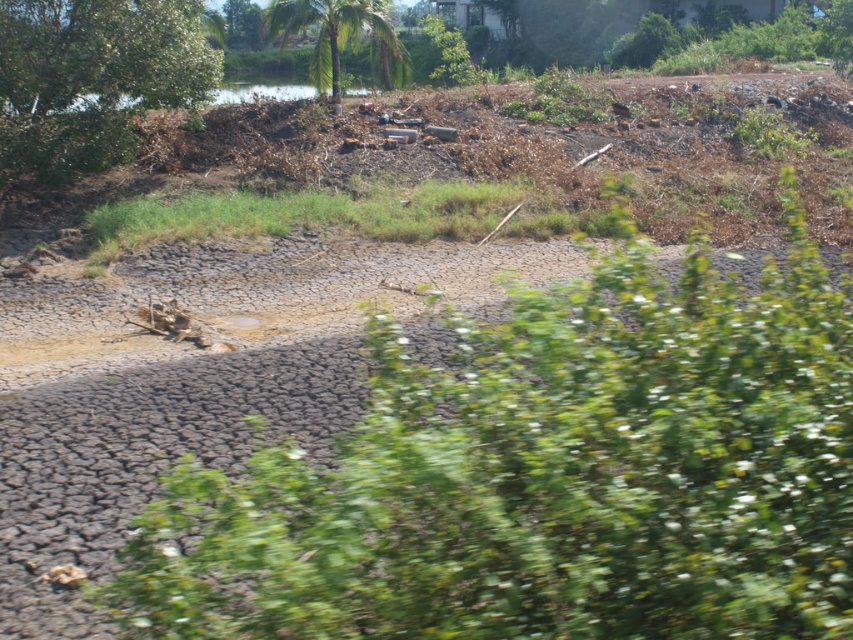
Question: Among these points, which one is farthest from the camera?

Choices:
 (A) (346, 20)
 (B) (126, 52)

Answer: (A)

Question: Is green leafy tree at center positioned before green leafy tree at upper left?

Choices:
 (A) no
 (B) yes

Answer: (B)

Question: Observing the image, what is the correct spatial positioning of green leafy tree at center in reference to green leafy palm at upper center?

Choices:
 (A) above
 (B) below

Answer: (B)

Question: Which of these objects is positioned closest to the green leafy palm at upper center?

Choices:
 (A) green leafy tree at center
 (B) green leafy tree at upper left

Answer: (B)

Question: Is the position of green leafy tree at center less distant than that of green leafy palm at upper center?

Choices:
 (A) no
 (B) yes

Answer: (B)

Question: Which object appears farthest from the camera in this image?

Choices:
 (A) green leafy tree at upper left
 (B) green leafy tree at center
 (C) green leafy palm at upper center

Answer: (C)